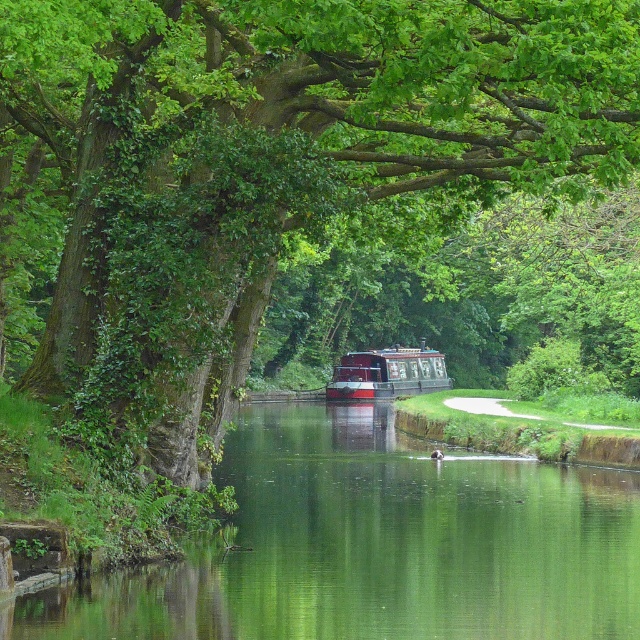
Is point (260, 429) positioned before point (385, 388)?

Yes, it is in front of point (385, 388).

Is point (35, 600) farther from camera compared to point (337, 380)?

No, (35, 600) is closer to viewer.

The width and height of the screenshot is (640, 640). I want to click on green smooth water at center, so click(376, 545).